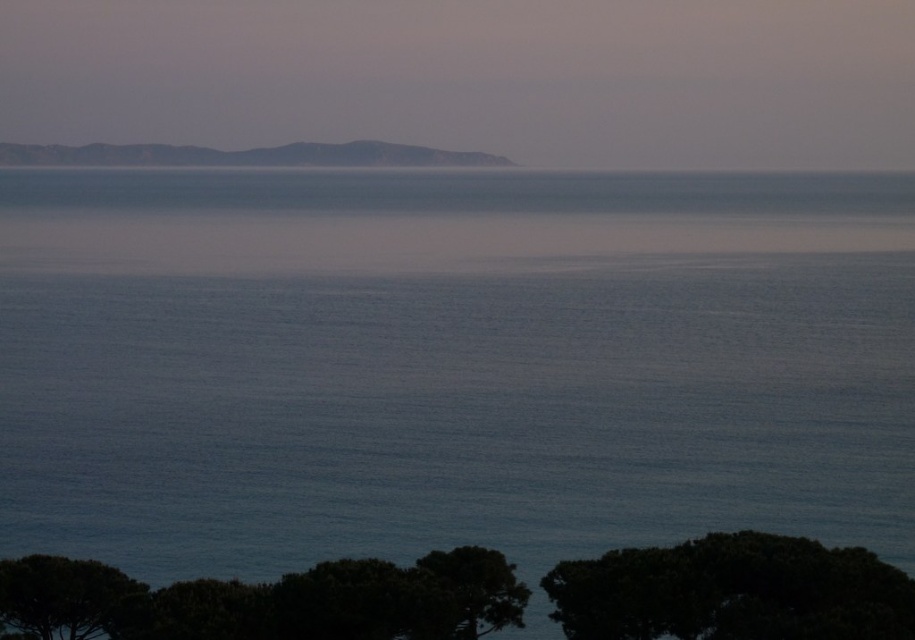
Describe the element at coordinates (449, 364) in the screenshot. I see `blue smooth water at center` at that location.

Does point (630, 387) come farther from viewer compared to point (593, 636)?

Yes, point (630, 387) is farther from viewer.

The width and height of the screenshot is (915, 640). What are the coordinates of `blue smooth water at center` in the screenshot? It's located at (449, 364).

Is dark green leafy tree at lower right bigger than dark green leafy tree at lower left?

Yes, dark green leafy tree at lower right is bigger than dark green leafy tree at lower left.

In order to click on dark green leafy tree at lower right in this screenshot , I will do `click(732, 592)`.

At what (x,y) coordinates should I click in order to perform the action: click on dark green leafy tree at lower right. Please return your answer as a coordinate pair (x, y). Looking at the image, I should click on (732, 592).

Who is taller, dark green leafy tree at lower right or gray rocky island at upper left?

Standing taller between the two is gray rocky island at upper left.

Identify the location of dark green leafy tree at lower right. This screenshot has width=915, height=640. (732, 592).

The width and height of the screenshot is (915, 640). Find the location of `dark green leafy tree at lower right`. dark green leafy tree at lower right is located at coordinates (732, 592).